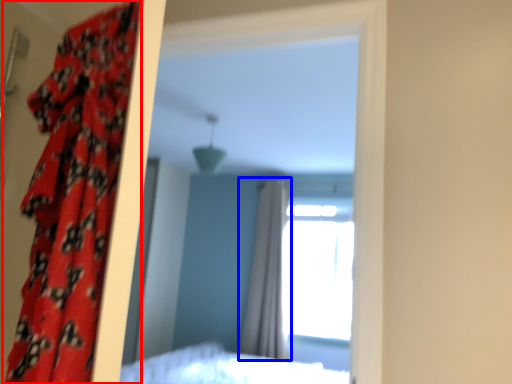
Question: Which object appears closest to the camera in this image, curtain (highlighted by a red box) or curtain (highlighted by a blue box)?

Choices:
 (A) curtain
 (B) curtain

Answer: (A)